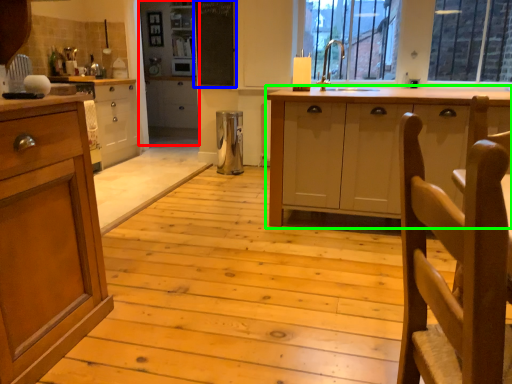
Question: Which is nearer to the screen door (highlighted by a red box)? bulletin board (highlighted by a blue box) or cabinetry (highlighted by a green box).

Choices:
 (A) bulletin board
 (B) cabinetry

Answer: (A)